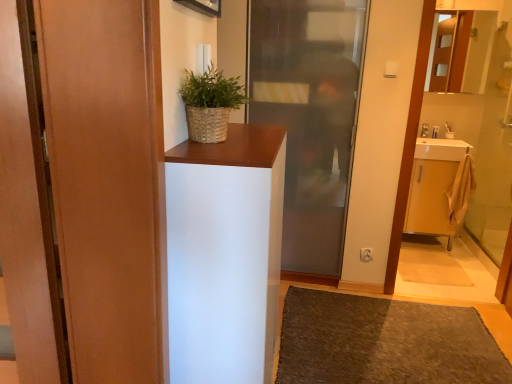
This screenshot has height=384, width=512. I want to click on vacant area that is in front of woven brown basket at upper center, so click(217, 153).